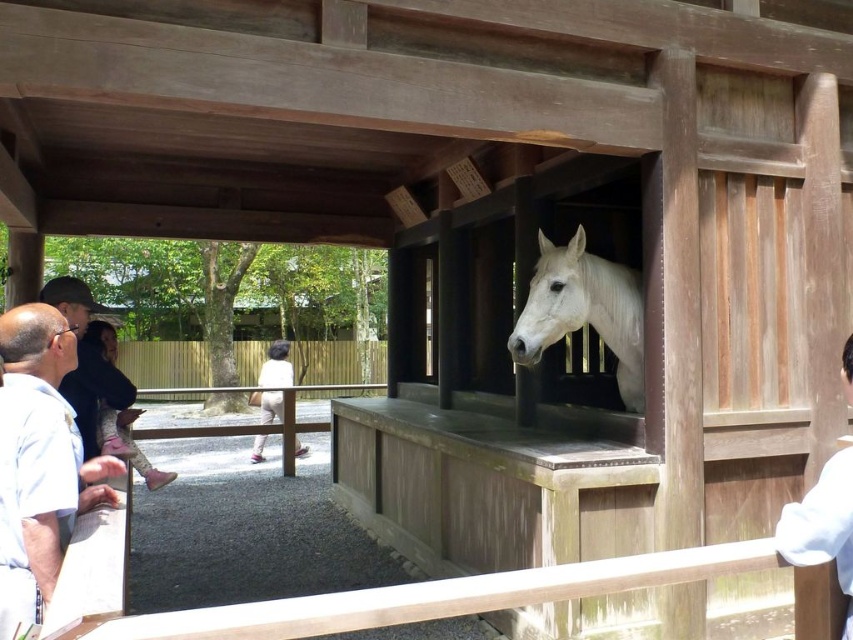
You are standing in the outdoor scene and want to move from the point closer to you to the farther point. Which path would you take between the two points, point (585, 310) and point (851, 340)?

You should move from point (585, 310) to point (851, 340) because point (585, 310) is closer to you and the other is farther away.

You are a photographer trying to capture both the matte black head at upper left and the white matte head at center in the same frame. Based on their sizes in the image, which head should you focus on first to ensure both fit in the frame?

The matte black head at upper left is bigger than the white matte head at center, so you should focus on the matte black head at upper left first to ensure both fit in the frame.

You are a photographer trying to capture a clear shot of the white glossy horse at center and the white matte head at center. Since you want to highlight the size difference between them, which object should you focus on first to ensure proper framing?

The white glossy horse at center is taller than the white matte head at center, so you should focus on the white glossy horse at center first to account for its larger size in the frame.